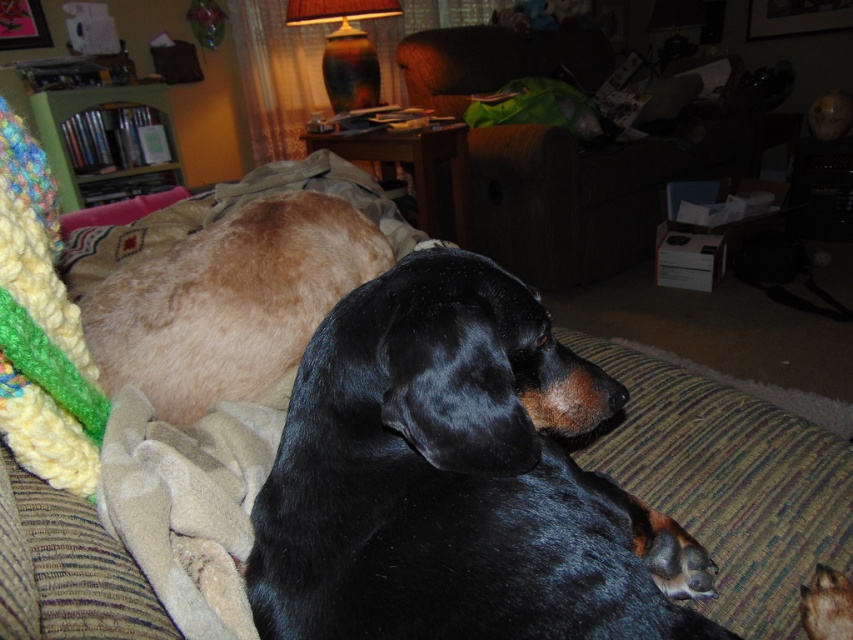
Does brown wood armchair at center have a greater height compared to golden fur dachshund at left?

Indeed, brown wood armchair at center has a greater height compared to golden fur dachshund at left.

Who is taller, brown wood armchair at center or golden fur dachshund at left?

Standing taller between the two is brown wood armchair at center.

Image resolution: width=853 pixels, height=640 pixels. What do you see at coordinates (590, 193) in the screenshot?
I see `brown wood armchair at center` at bounding box center [590, 193].

The height and width of the screenshot is (640, 853). Find the location of `brown wood armchair at center`. brown wood armchair at center is located at coordinates (590, 193).

Is black smooth dog at center bigger than golden fur dachshund at left?

No, black smooth dog at center is not bigger than golden fur dachshund at left.

Does black smooth dog at center have a greater height compared to golden fur dachshund at left?

Incorrect, black smooth dog at center's height is not larger of golden fur dachshund at left's.

The height and width of the screenshot is (640, 853). In order to click on black smooth dog at center in this screenshot , I will do `click(456, 480)`.

Is black smooth dog at center behind brown wood armchair at center?

No, black smooth dog at center is closer to the viewer.

The image size is (853, 640). What do you see at coordinates (456, 480) in the screenshot? I see `black smooth dog at center` at bounding box center [456, 480].

Is point (460, 467) farther from viewer compared to point (624, 248)?

That is False.

Identify the location of black smooth dog at center. (456, 480).